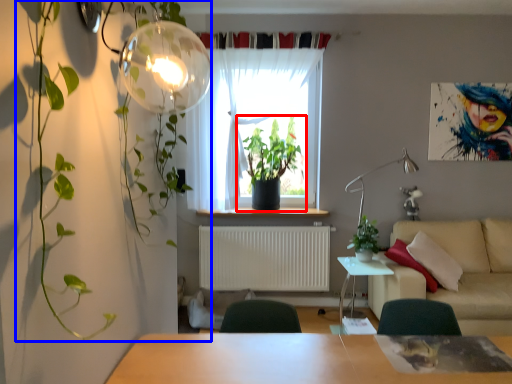
Question: Which point is closer to the camera, houseplant (highlighted by a red box) or vegetation (highlighted by a blue box)?

Choices:
 (A) houseplant
 (B) vegetation

Answer: (B)